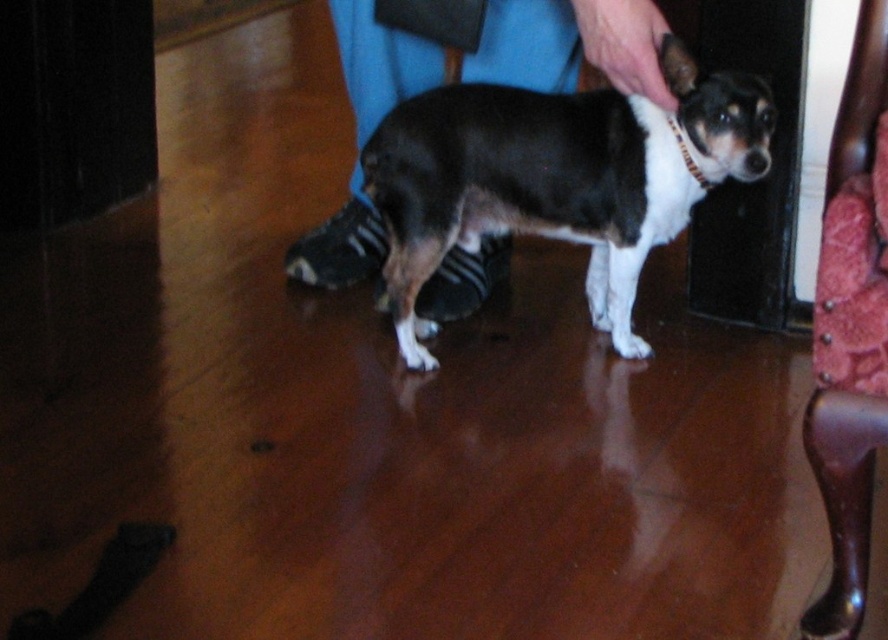
Question: Among these objects, which one is nearest to the camera?

Choices:
 (A) velvet red armchair at right
 (B) black smooth dog at center

Answer: (A)

Question: Does black smooth dog at center appear under velvet red armchair at right?

Choices:
 (A) no
 (B) yes

Answer: (A)

Question: Does black smooth dog at center have a larger size compared to velvet red armchair at right?

Choices:
 (A) no
 (B) yes

Answer: (B)

Question: Among these objects, which one is nearest to the camera?

Choices:
 (A) velvet red armchair at right
 (B) black smooth dog at center

Answer: (A)

Question: Is black smooth dog at center closer to camera compared to velvet red armchair at right?

Choices:
 (A) no
 (B) yes

Answer: (A)